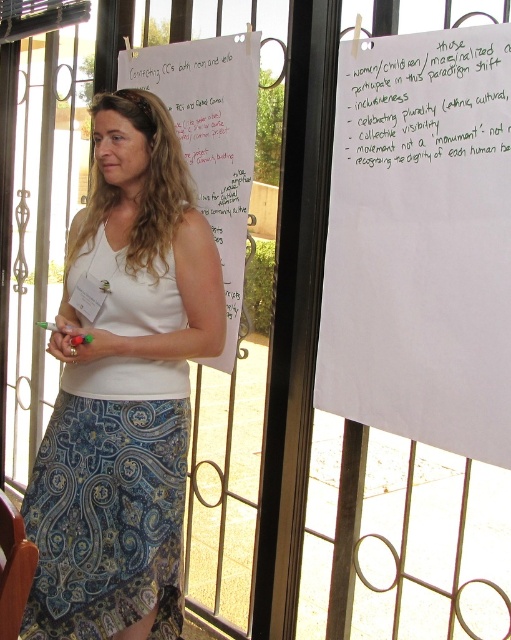
What is the exact location of the white cotton tank top at center in the image?

The white cotton tank top at center is located at point 0.608 on the x axis and 0.243 on the y axis.